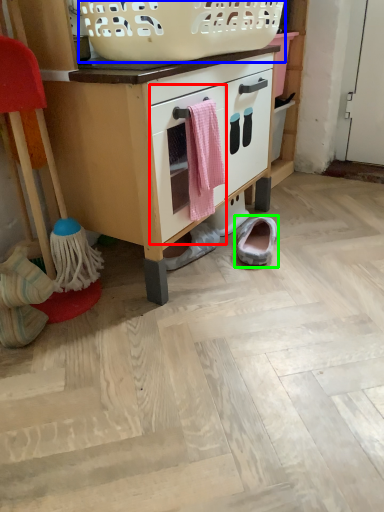
Question: Considering the real-world distances, which object is farthest from drawer (highlighted by a red box)? basket (highlighted by a blue box) or footwear (highlighted by a green box)?

Choices:
 (A) basket
 (B) footwear

Answer: (B)